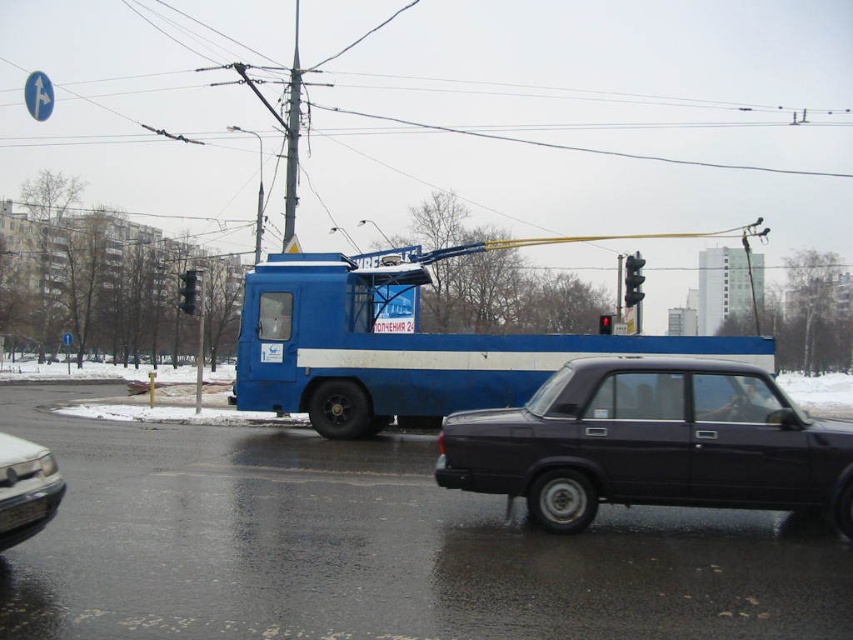
Question: Considering the real-world distances, which object is closest to the black glass traffic light at upper center?

Choices:
 (A) red plastic traffic light at center
 (B) shiny silver car at lower left
 (C) black glass traffic light at right
 (D) black metal license plate at lower left

Answer: (A)

Question: Is black metal license plate at lower left thinner than red plastic traffic light at center?

Choices:
 (A) yes
 (B) no

Answer: (A)

Question: Is shiny silver car at lower left closer to the viewer compared to black metal license plate at lower left?

Choices:
 (A) no
 (B) yes

Answer: (A)

Question: Which of these objects is positioned farthest from the black glass traffic light at upper center?

Choices:
 (A) black glass traffic light at right
 (B) shiny silver car at lower left
 (C) blue matte truck at center
 (D) red plastic traffic light at center

Answer: (C)

Question: Does black glass traffic light at upper center have a lesser width compared to red plastic traffic light at center?

Choices:
 (A) no
 (B) yes

Answer: (B)

Question: Based on their relative distances, which object is farther from the black metal license plate at lower left?

Choices:
 (A) red plastic traffic light at center
 (B) shiny black sedan at center
 (C) blue matte truck at center

Answer: (C)